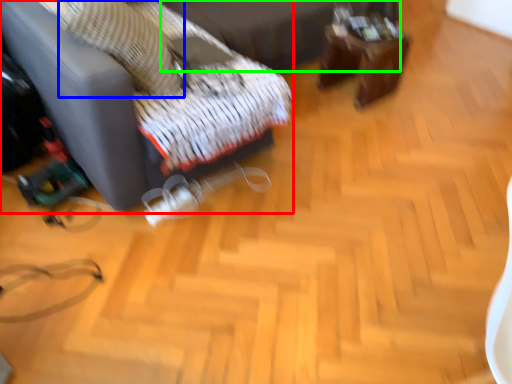
Question: Estimate the real-world distances between objects in this image. Which object is farther from furniture (highlighted by a red box), pillow (highlighted by a blue box) or bed frame (highlighted by a green box)?

Choices:
 (A) pillow
 (B) bed frame

Answer: (B)